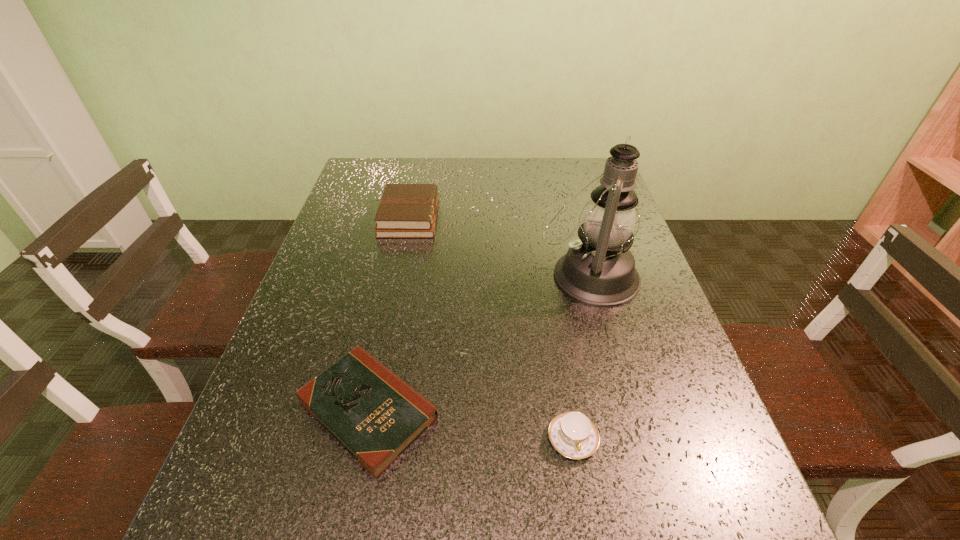
You are a GUI agent. You are given a task and a screenshot of the screen. Output one action in this format:
    pyautogui.click(x=<x>, y=<y>)
    Task: Click on the vacant area in the image that satisfies the following two spatial constraints: 1. on the spine side of the oil lamp; 2. on the left side of the farthest object
    
    Given the screenshot: What is the action you would take?
    pyautogui.click(x=397, y=275)

Find the location of `vacant space that satisfies the following two spatial constraints: 1. on the spine side of the farther Bible; 2. on the front side of the shortest object`. vacant space that satisfies the following two spatial constraints: 1. on the spine side of the farther Bible; 2. on the front side of the shortest object is located at coordinates (370, 409).

You are a GUI agent. You are given a task and a screenshot of the screen. Output one action in this format:
    pyautogui.click(x=<x>, y=<y>)
    Task: Click on the free spot that satisfies the following two spatial constraints: 1. on the spine side of the farther Bible; 2. on the right side of the second farthest object
    
    Given the screenshot: What is the action you would take?
    pyautogui.click(x=397, y=275)